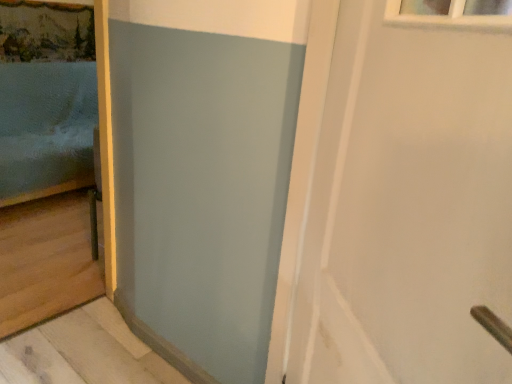
Question: In terms of width, does matte blue bed at left look wider or thinner when compared to white matte door at upper right?

Choices:
 (A) wide
 (B) thin

Answer: (A)

Question: Considering the positions of matte blue bed at left and white matte door at upper right in the image, is matte blue bed at left bigger or smaller than white matte door at upper right?

Choices:
 (A) big
 (B) small

Answer: (A)

Question: Is point (18, 198) positioned closer to the camera than point (357, 162)?

Choices:
 (A) closer
 (B) farther

Answer: (B)

Question: From the image's perspective, relative to matte blue bed at left, is white matte door at upper right above or below?

Choices:
 (A) below
 (B) above

Answer: (A)

Question: Considering their positions, is white matte door at upper right located in front of or behind matte blue bed at left?

Choices:
 (A) front
 (B) behind

Answer: (A)

Question: From a real-world perspective, is white matte door at upper right positioned above or below matte blue bed at left?

Choices:
 (A) above
 (B) below

Answer: (A)

Question: Considering the positions of white matte door at upper right and matte blue bed at left in the image, is white matte door at upper right bigger or smaller than matte blue bed at left?

Choices:
 (A) small
 (B) big

Answer: (A)